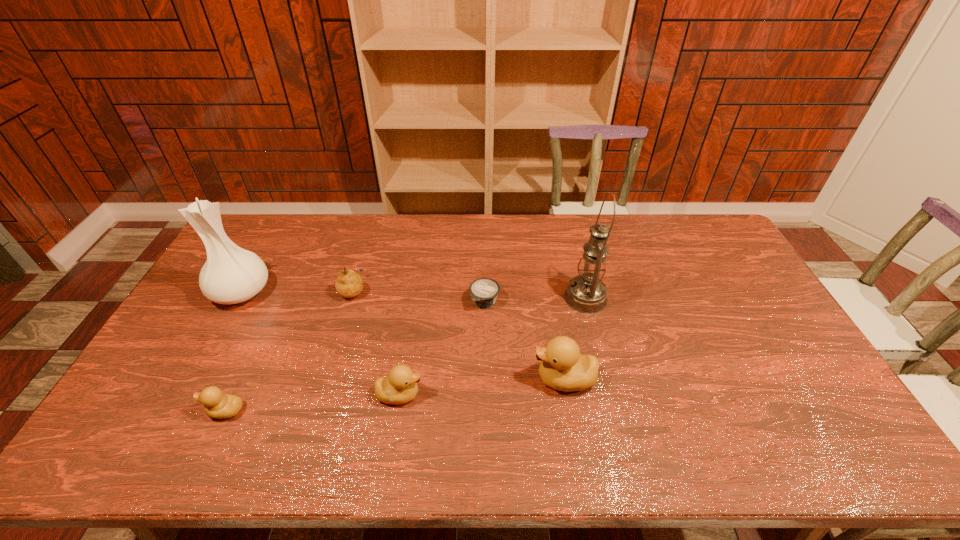
Find the location of a particular element. The height and width of the screenshot is (540, 960). the shortest duckling is located at coordinates (216, 404).

Where is `the second shortest object`? The height and width of the screenshot is (540, 960). the second shortest object is located at coordinates (216, 404).

Find the location of a particular element. the second duckling from right to left is located at coordinates (x=400, y=386).

Find the location of a particular element. The height and width of the screenshot is (540, 960). the second tallest duckling is located at coordinates (400, 386).

The width and height of the screenshot is (960, 540). I want to click on the rightmost duckling, so click(x=563, y=367).

Where is `the third tallest object`? the third tallest object is located at coordinates (563, 367).

You are a GUI agent. You are given a task and a screenshot of the screen. Output one action in this format:
    pyautogui.click(x=<x>, y=<y>)
    Task: Click on the sixth shortest object
    The width and height of the screenshot is (960, 540).
    Given the screenshot: What is the action you would take?
    pyautogui.click(x=231, y=274)

Where is `pear`? pear is located at coordinates click(349, 284).

Where is `the fifth object from left to right`? the fifth object from left to right is located at coordinates (484, 291).

This screenshot has height=540, width=960. Find the location of `the shortest object`. the shortest object is located at coordinates (484, 291).